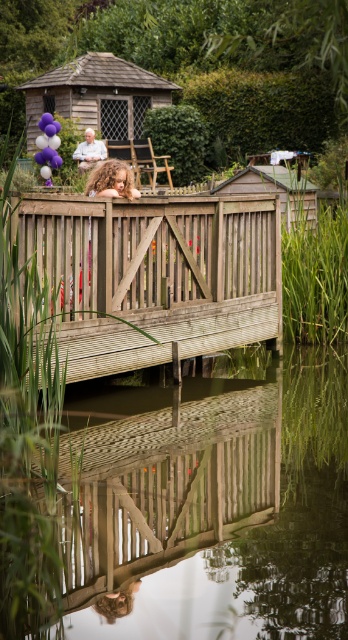
Which is in front, point (285, 372) or point (111, 99)?

Point (285, 372) is in front.

Image resolution: width=348 pixels, height=640 pixels. What do you see at coordinates (192, 509) in the screenshot? I see `transparent water at bridge center` at bounding box center [192, 509].

Does point (112, 464) come farther from viewer compared to point (81, 60)?

No.

Identify the location of transparent water at bridge center. (192, 509).

Is wooden bridge at center positioned behind wooden gazebo at upper center?

No, it is not.

Between point (49, 237) and point (148, 77), which one is positioned in front?

Point (49, 237)

You are a GUI agent. You are given a task and a screenshot of the screen. Output one action in this format:
    pyautogui.click(x=<x>, y=<y>)
    Task: Click on the wooden bridge at center
    The width and height of the screenshot is (348, 640).
    Given the screenshot: What is the action you would take?
    pyautogui.click(x=153, y=275)

Is wooden gazebo at upper center bigger than matte white shirt at upper center?

Yes.

Looking at this image, is wooden gazebo at upper center above matte white shirt at upper center?

Correct, wooden gazebo at upper center is located above matte white shirt at upper center.

Is point (75, 67) more distant than point (90, 161)?

That is True.

Identify the location of wooden gazebo at upper center. Image resolution: width=348 pixels, height=640 pixels. (97, 93).